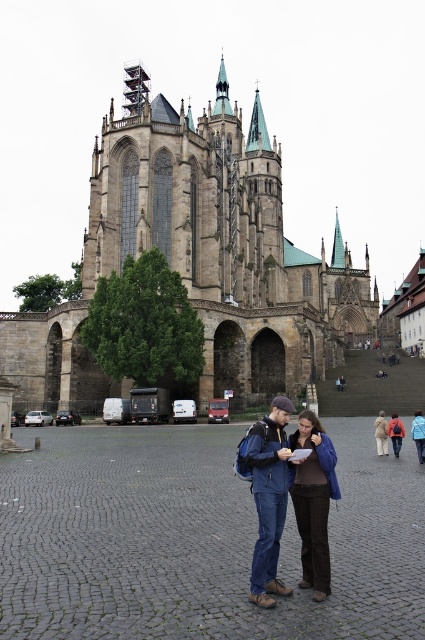
Question: Which object is positioned closest to the matte blue jacket at center?

Choices:
 (A) brown leather jacket at center
 (B) denim jacket at center

Answer: (B)

Question: Which of the following is the closest to the observer?

Choices:
 (A) brown leather jacket at center
 (B) matte blue jacket at center

Answer: (B)

Question: Is denim jacket at center positioned in front of brown leather jacket at center?

Choices:
 (A) no
 (B) yes

Answer: (B)

Question: Can you confirm if brown stone church at upper center is positioned below matte blue jacket at center?

Choices:
 (A) yes
 (B) no

Answer: (B)

Question: Which object appears closest to the camera in this image?

Choices:
 (A) brown leather jacket at center
 (B) brown stone church at upper center
 (C) denim jacket at center
 (D) matte blue jacket at center

Answer: (C)

Question: Is matte blue jacket at center wider than brown leather jacket at center?

Choices:
 (A) no
 (B) yes

Answer: (A)